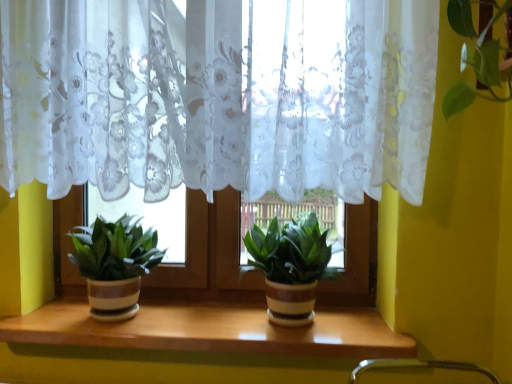
Question: From a real-world perspective, does green matte plant pot at center, the first houseplant in the right-to-left sequence, sit lower than green matte plant pot at left, which is the second houseplant in right-to-left order?

Choices:
 (A) yes
 (B) no

Answer: (A)

Question: From the image's perspective, would you say green matte plant pot at center, positioned as the 2th houseplant in left-to-right order, is shown under green matte plant pot at left, which is the second houseplant in right-to-left order?

Choices:
 (A) yes
 (B) no

Answer: (A)

Question: Is green matte plant pot at center, positioned as the 2th houseplant in left-to-right order, touching green matte plant pot at left, the first houseplant positioned from the left?

Choices:
 (A) yes
 (B) no

Answer: (B)

Question: Is green matte plant pot at center, the first houseplant in the right-to-left sequence, positioned far away from green matte plant pot at left, the first houseplant positioned from the left?

Choices:
 (A) yes
 (B) no

Answer: (B)

Question: Is green matte plant pot at center, positioned as the 2th houseplant in left-to-right order, shorter than green matte plant pot at left, which is the second houseplant in right-to-left order?

Choices:
 (A) no
 (B) yes

Answer: (A)

Question: Is green matte plant pot at left, which is the second houseplant in right-to-left order, spatially inside wooden at center, or outside of it?

Choices:
 (A) outside
 (B) inside

Answer: (A)

Question: In terms of height, does green matte plant pot at left, which is the second houseplant in right-to-left order, look taller or shorter compared to wooden at center?

Choices:
 (A) tall
 (B) short

Answer: (A)

Question: Visually, is green matte plant pot at left, which is the second houseplant in right-to-left order, positioned to the left or to the right of wooden at center?

Choices:
 (A) right
 (B) left

Answer: (B)

Question: Relative to wooden at center, is green matte plant pot at left, which is the second houseplant in right-to-left order, in front or behind?

Choices:
 (A) front
 (B) behind

Answer: (B)

Question: From a real-world perspective, is green matte plant pot at center, positioned as the 2th houseplant in left-to-right order, above or below wooden at center?

Choices:
 (A) above
 (B) below

Answer: (A)

Question: Is green matte plant pot at center, positioned as the 2th houseplant in left-to-right order, to the left or to the right of wooden at center in the image?

Choices:
 (A) right
 (B) left

Answer: (A)

Question: Is green matte plant pot at center, the first houseplant in the right-to-left sequence, inside the boundaries of wooden at center, or outside?

Choices:
 (A) inside
 (B) outside

Answer: (B)

Question: Relative to wooden at center, is green matte plant pot at center, the first houseplant in the right-to-left sequence, in front or behind?

Choices:
 (A) front
 (B) behind

Answer: (A)

Question: From the image's perspective, is green matte plant pot at left, which is the second houseplant in right-to-left order, positioned above or below green matte plant pot at center, positioned as the 2th houseplant in left-to-right order?

Choices:
 (A) below
 (B) above

Answer: (B)

Question: In the image, is green matte plant pot at left, which is the second houseplant in right-to-left order, positioned in front of or behind green matte plant pot at center, the first houseplant in the right-to-left sequence?

Choices:
 (A) front
 (B) behind

Answer: (B)